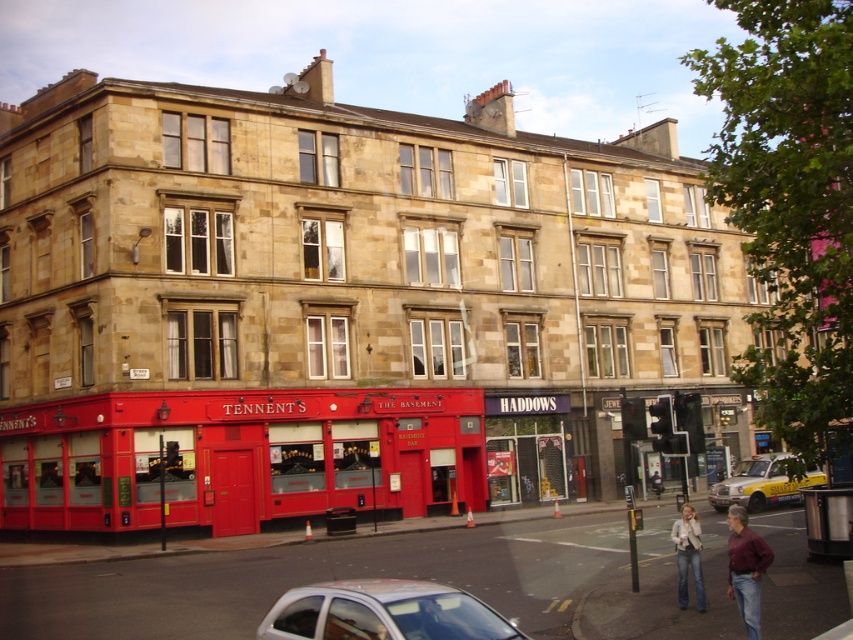
Does white glossy car at lower center appear on the right side of maroon cotton shirt at lower right?

In fact, white glossy car at lower center is to the left of maroon cotton shirt at lower right.

Does point (460, 595) lie behind point (734, 532)?

No, (460, 595) is in front of (734, 532).

The height and width of the screenshot is (640, 853). What do you see at coordinates (383, 612) in the screenshot?
I see `white glossy car at lower center` at bounding box center [383, 612].

At what (x,y) coordinates should I click in order to perform the action: click on white glossy car at lower center. Please return your answer as a coordinate pair (x, y). The image size is (853, 640). Looking at the image, I should click on (383, 612).

Can you confirm if red painted bus at lower center is positioned to the left of denim jacket at lower right?

Indeed, red painted bus at lower center is positioned on the left side of denim jacket at lower right.

Between red painted bus at lower center and denim jacket at lower right, which one has less height?

Standing shorter between the two is denim jacket at lower right.

Is point (234, 531) behind point (701, 572)?

Yes, point (234, 531) is behind point (701, 572).

At what (x,y) coordinates should I click in order to perform the action: click on red painted bus at lower center. Please return your answer as a coordinate pair (x, y). This screenshot has width=853, height=640. Looking at the image, I should click on (236, 456).

Between maroon cotton shirt at lower right and denim jacket at lower right, which one appears on the left side from the viewer's perspective?

From the viewer's perspective, denim jacket at lower right appears more on the left side.

Consider the image. Who is more distant from viewer, (x=730, y=556) or (x=693, y=577)?

Point (x=693, y=577)

The image size is (853, 640). In order to click on maroon cotton shirt at lower right in this screenshot , I will do `click(746, 568)`.